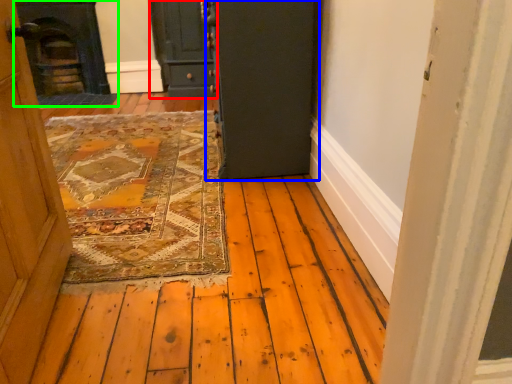
Question: Which is farther away from door (highlighted by a red box)? door (highlighted by a blue box) or fireplace (highlighted by a green box)?

Choices:
 (A) door
 (B) fireplace

Answer: (A)